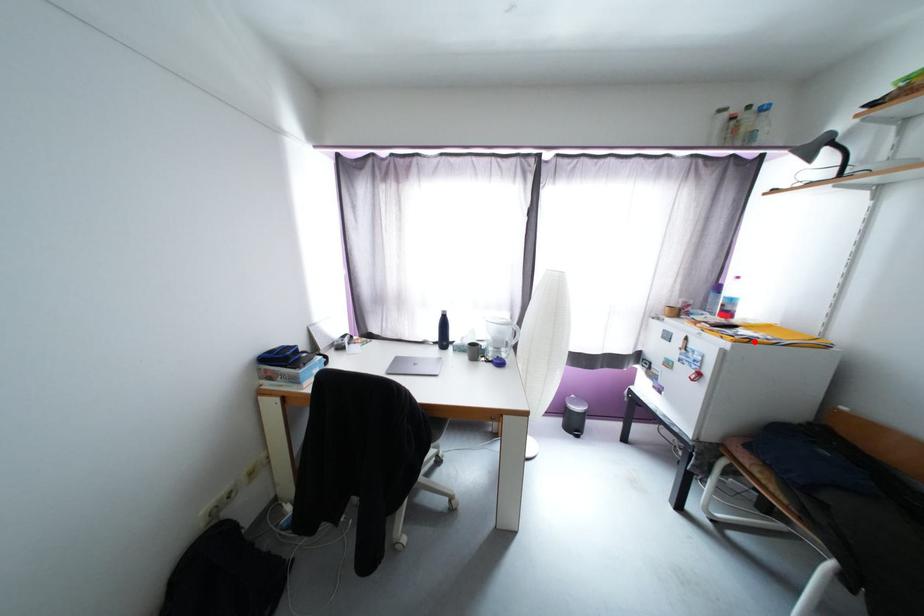
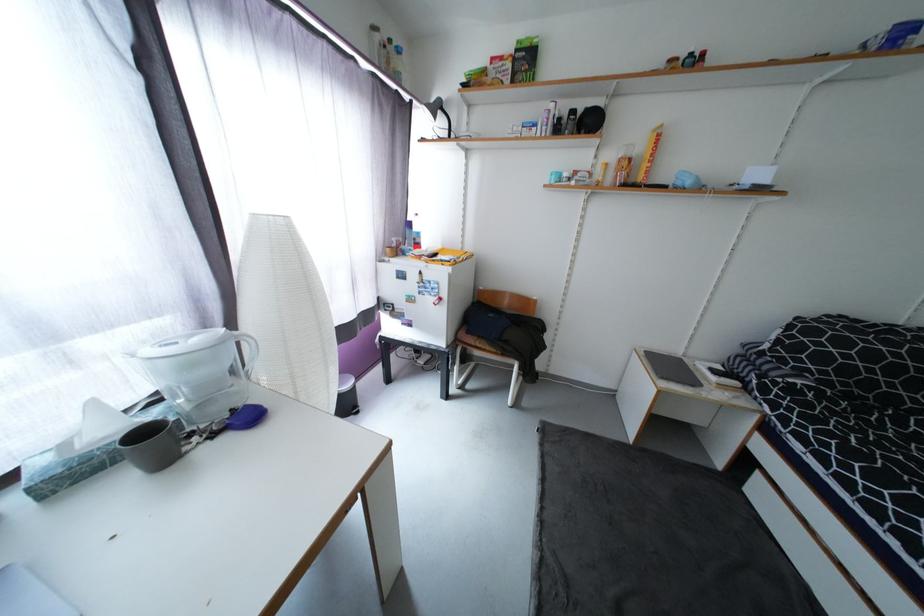
Where in the second image is the point corresponding to the highlighted location from the first image?

(460, 264)